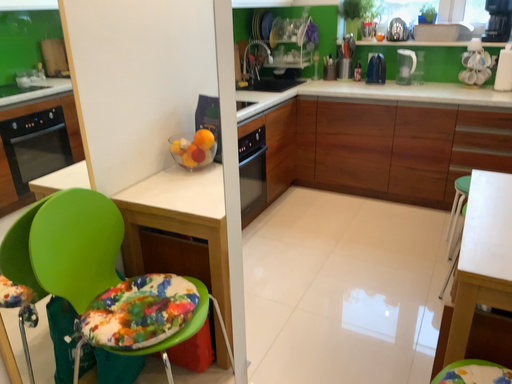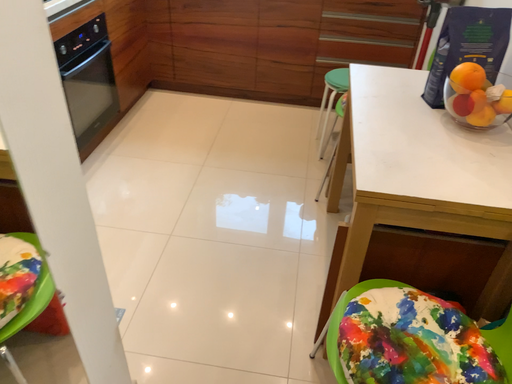
Question: How did the camera likely rotate when shooting the video?

Choices:
 (A) rotated left
 (B) rotated right

Answer: (B)